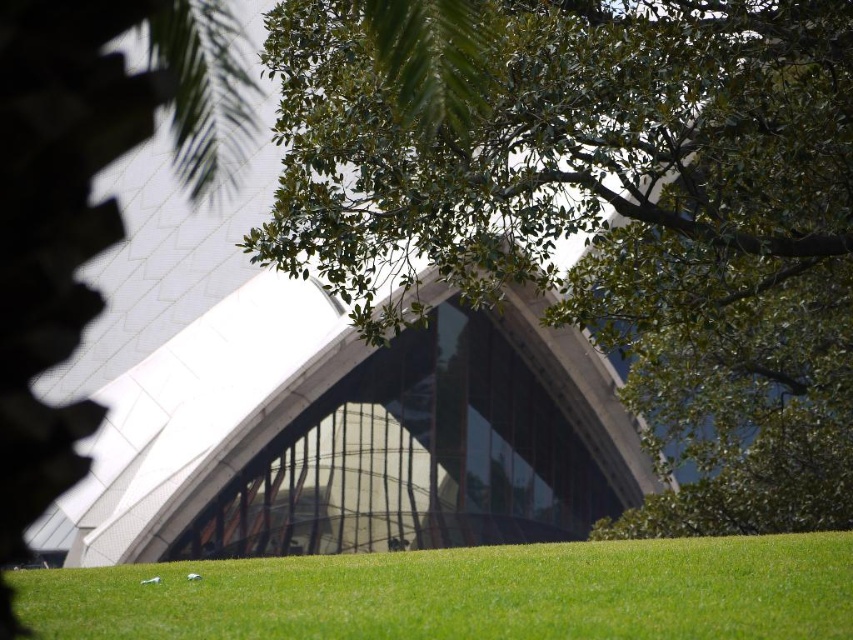
Is green leafy tree at center taller than green grass at lower center?

Indeed, green leafy tree at center has a greater height compared to green grass at lower center.

Looking at this image, can you confirm if green leafy tree at center is wider than green grass at lower center?

No, green leafy tree at center is not wider than green grass at lower center.

The image size is (853, 640). I want to click on green leafy tree at center, so coord(619,214).

The width and height of the screenshot is (853, 640). I want to click on green leafy tree at center, so click(619, 214).